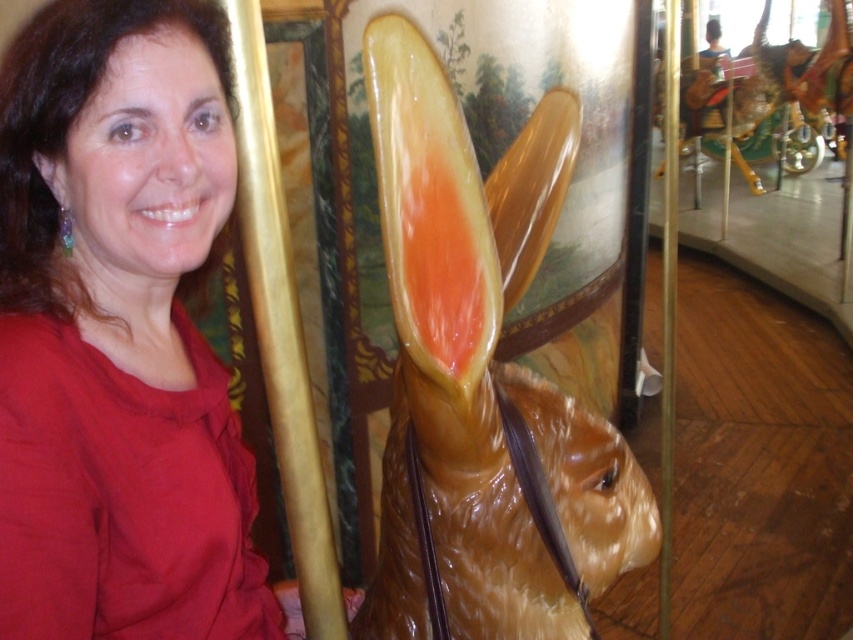
Question: Which object appears farthest from the camera in this image?

Choices:
 (A) brown glossy rabbit at center
 (B) matte red blouse at upper left

Answer: (B)

Question: Does matte red blouse at upper left appear on the left side of brown glossy rabbit at center?

Choices:
 (A) no
 (B) yes

Answer: (B)

Question: Can you confirm if matte red blouse at upper left is positioned above brown glossy rabbit at center?

Choices:
 (A) yes
 (B) no

Answer: (B)

Question: Is matte red blouse at upper left below brown glossy rabbit at center?

Choices:
 (A) yes
 (B) no

Answer: (A)

Question: Which point is farther to the camera?

Choices:
 (A) (141, 360)
 (B) (647, 547)

Answer: (B)